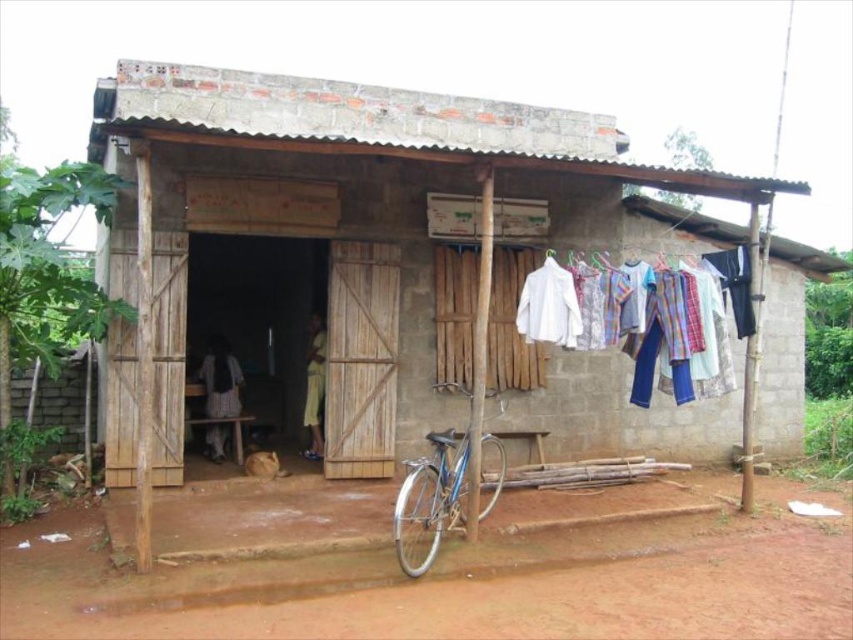
You are standing at the entrance of the brown wooden hut at center and want to move the blue metallic bicycle at lower center to the back of the hut. Is the bicycle currently positioned in front of the hut?

The brown wooden hut at center is located above the blue metallic bicycle at lower center, meaning the bicycle is positioned in front of the hut. To move it to the back, you would need to move it behind the hut.

You are a delivery person with a cart that is 2 meters wide. You need to move from the blue metallic bicycle at lower center to the brown wooden hut at center. Is there enough space between them for your cart to pass through?

The distance between the brown wooden hut at center and the blue metallic bicycle at lower center is 2.13 meters, so yes, the cart can pass through since it is wider than the cart.

You are a customer visiting the shop and see the white cotton shirts at center and the blue metallic bicycle at lower center. Which object is positioned to the right side from your perspective?

The white cotton shirts at center are positioned to the right of the blue metallic bicycle at lower center.